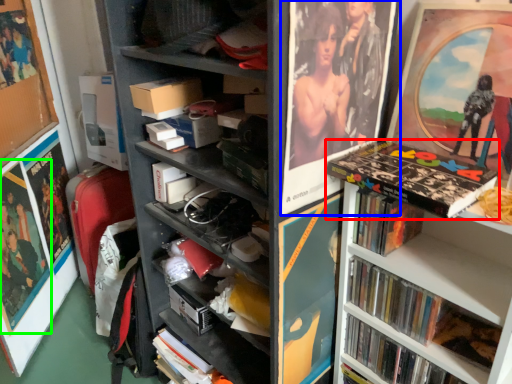
Question: Estimate the real-world distances between objects in this image. Which object is closer to book (highlighted by a red box), picture frame (highlighted by a blue box) or poster page (highlighted by a green box)?

Choices:
 (A) picture frame
 (B) poster page

Answer: (A)